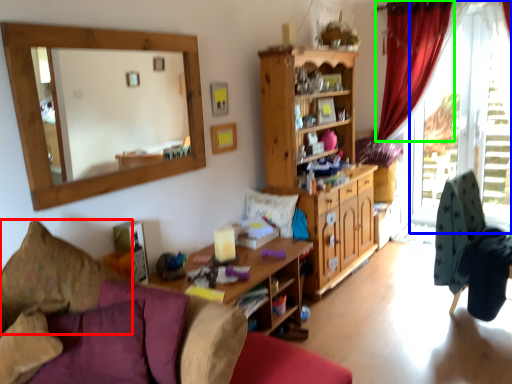
Question: Which object is the farthest from pillow (highlighted by a red box)? Choose among these: window frame (highlighted by a blue box) or curtain (highlighted by a green box).

Choices:
 (A) window frame
 (B) curtain

Answer: (A)